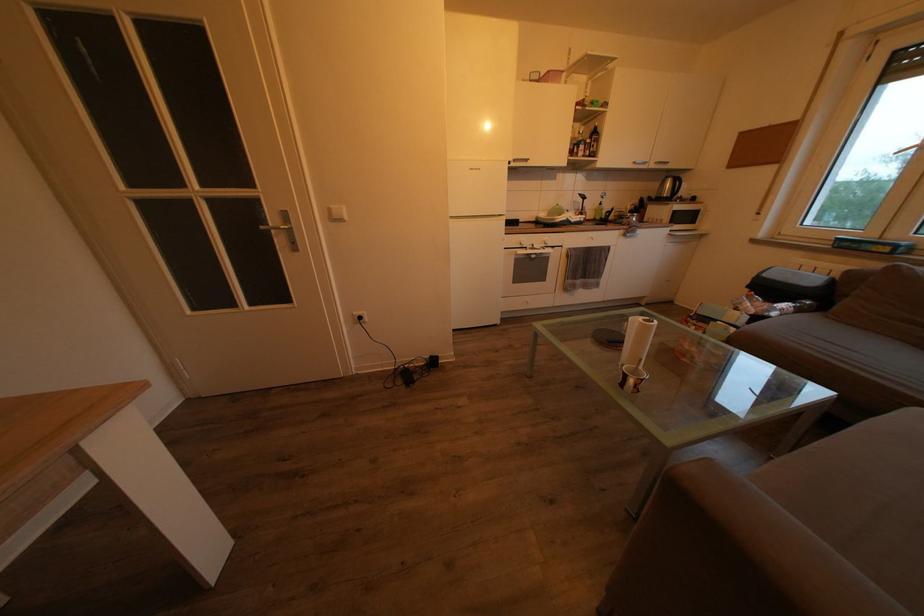
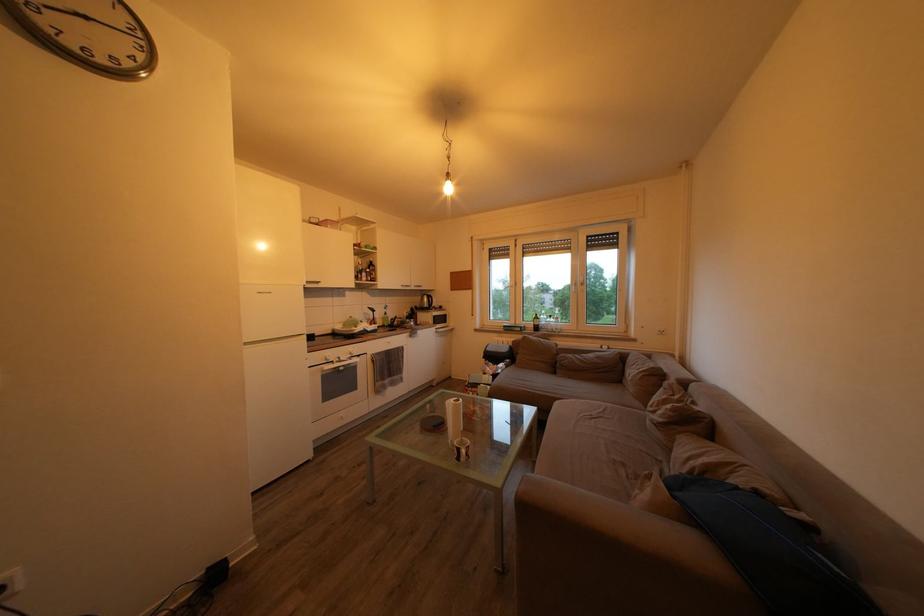
In the second image, find the point that corresponds to the point at 637,211 in the first image.

(412, 318)